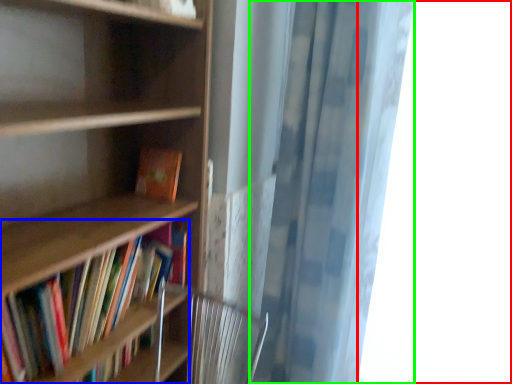
Question: Which object is the closest to the window (highlighted by a red box)? Choose among these: book (highlighted by a blue box) or shower curtain (highlighted by a green box).

Choices:
 (A) book
 (B) shower curtain

Answer: (B)